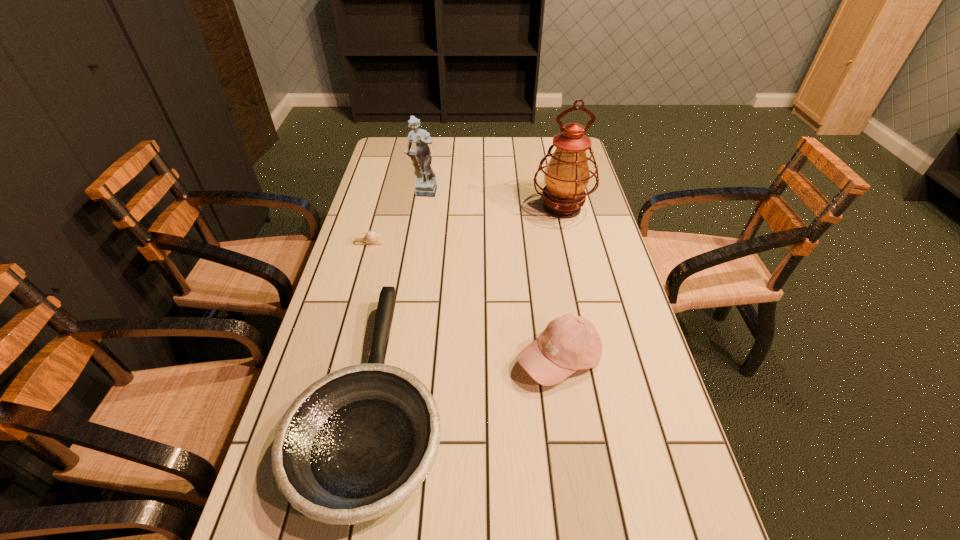
Locate an element on the screen. This screenshot has width=960, height=540. vacant space in between the figurine and the frying pan is located at coordinates (398, 294).

Identify the location of empty location between the figurine and the third tallest object. The width and height of the screenshot is (960, 540). coord(491,276).

I want to click on the second closest object to the escargot, so click(x=354, y=445).

This screenshot has width=960, height=540. What are the coordinates of `object identified as the fourth closest to the escargot` in the screenshot? It's located at (569, 343).

Find the location of a particular element. vacant region that satisfies the following two spatial constraints: 1. on the front-facing side of the tallest object; 2. on the left side of the figurine is located at coordinates (420, 208).

Locate an element on the screen. The height and width of the screenshot is (540, 960). vacant space that satisfies the following two spatial constraints: 1. on the handle side of the frying pan; 2. on the right side of the oil lamp is located at coordinates (411, 208).

Image resolution: width=960 pixels, height=540 pixels. I want to click on blank space that satisfies the following two spatial constraints: 1. on the handle side of the tallest object; 2. on the left side of the frying pan, so click(x=411, y=208).

The height and width of the screenshot is (540, 960). I want to click on vacant space that satisfies the following two spatial constraints: 1. on the handle side of the frying pan; 2. on the shell of the escargot, so click(404, 242).

Locate an element on the screen. Image resolution: width=960 pixels, height=540 pixels. blank space that satisfies the following two spatial constraints: 1. on the front-facing side of the second tallest object; 2. on the left side of the oil lamp is located at coordinates pos(420,208).